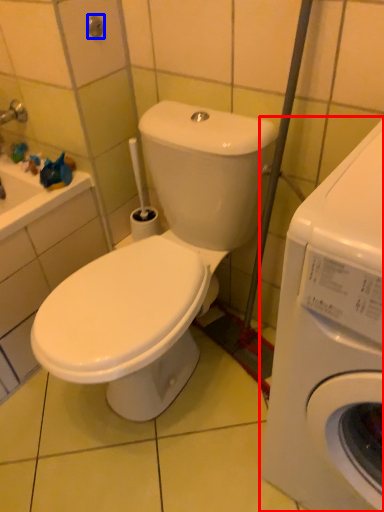
Question: Which point is further to the camera, washing machine (highlighted by a red box) or shower (highlighted by a blue box)?

Choices:
 (A) washing machine
 (B) shower

Answer: (B)